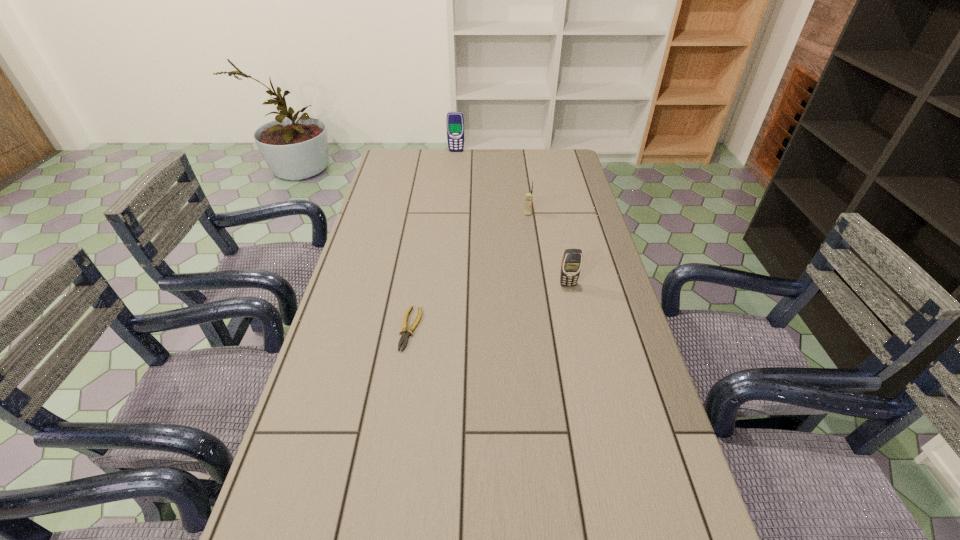
Point out which cellular telephone is positioned as the nearest to the third farthest object. Please provide its 2D coordinates. Your answer should be formatted as a tuple, i.e. [(x, y)], where the tuple contains the x and y coordinates of a point satisfying the conditions above.

[(529, 196)]

Identify the location of cellular telephone that stands as the second closest to the rightmost object. The width and height of the screenshot is (960, 540). (455, 121).